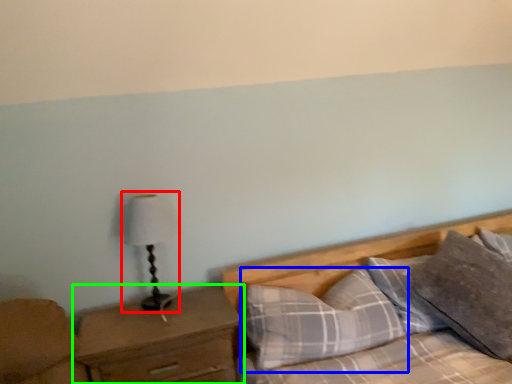
Question: Considering the real-world distances, which object is closest to table lamp (highlighted by a red box)? pillow (highlighted by a blue box) or nightstand (highlighted by a green box).

Choices:
 (A) pillow
 (B) nightstand

Answer: (B)